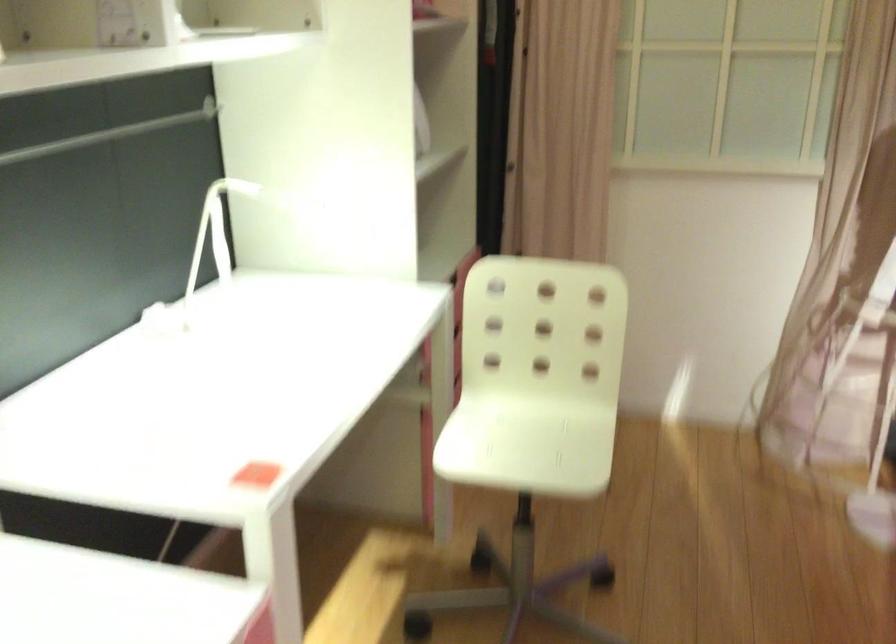
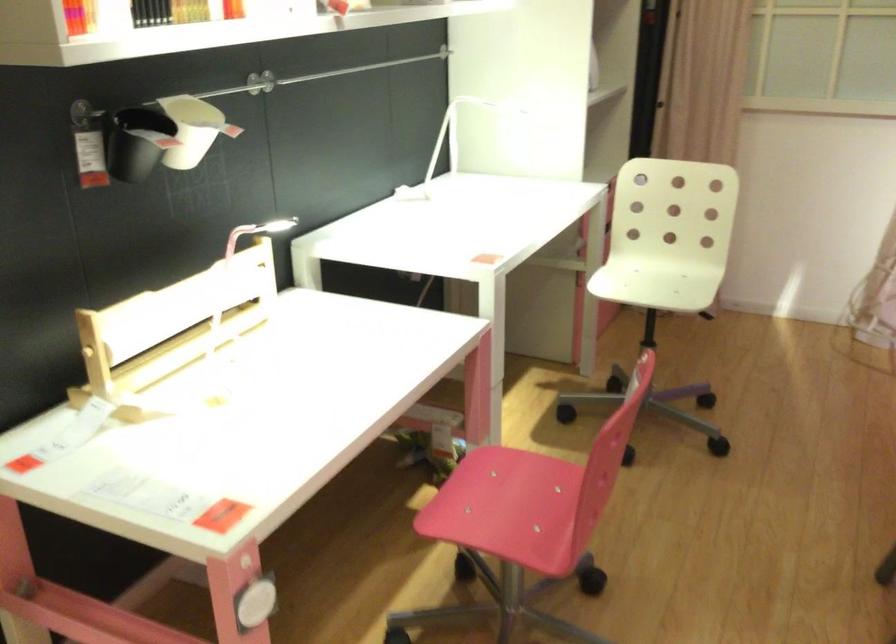
Question: The images are taken continuously from a first-person perspective. In which direction is your viewpoint rotating?

Choices:
 (A) Left
 (B) Right
 (C) Up
 (D) Down

Answer: (A)